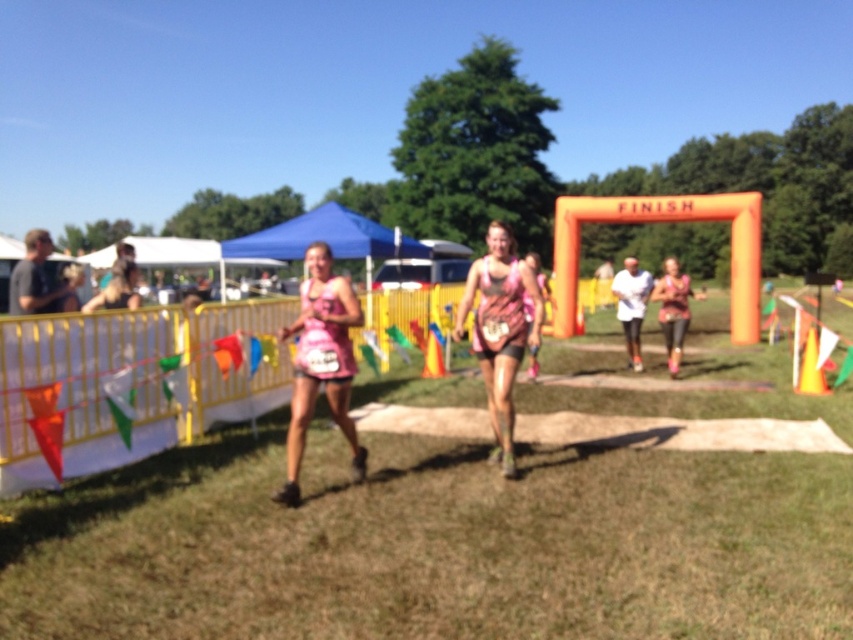
Question: Does pink fabric dress at center appear under matte pink tank top at center?

Choices:
 (A) yes
 (B) no

Answer: (A)

Question: Which object appears farthest from the camera in this image?

Choices:
 (A) green grass at center
 (B) matte pink tank top at center
 (C) pink fabric dress at center

Answer: (B)

Question: Does pink fabric tank top at center appear on the left side of matte pink tank top at center?

Choices:
 (A) no
 (B) yes

Answer: (B)

Question: Which point is closer to the camera?

Choices:
 (A) matte pink tank top at center
 (B) pink fabric dress at center
 (C) pink fabric tank top at center
 (D) green grass at center

Answer: (D)

Question: Is green grass at center to the left of matte pink tank top at center from the viewer's perspective?

Choices:
 (A) no
 (B) yes

Answer: (B)

Question: Which point appears farthest from the camera in this image?

Choices:
 (A) (344, 492)
 (B) (305, 360)
 (C) (680, 292)
 (D) (480, 272)

Answer: (C)